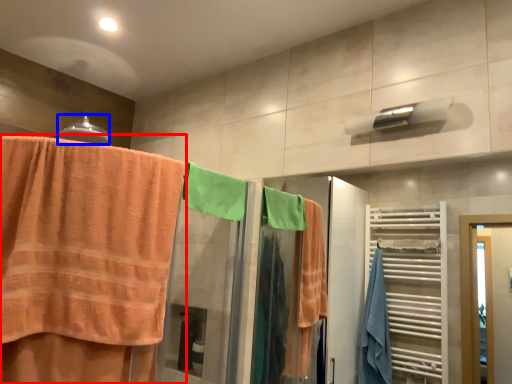
Question: Which of the following is the farthest to the observer, towel (highlighted by a red box) or towel bar (highlighted by a blue box)?

Choices:
 (A) towel
 (B) towel bar

Answer: (B)